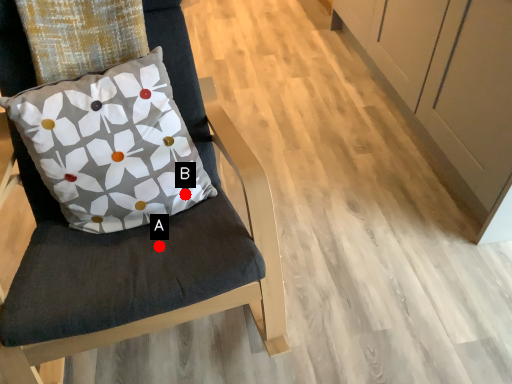
Question: Two points are circled on the image, labeled by A and B beside each circle. Which of the following is the farthest from the observer?

Choices:
 (A) A is further
 (B) B is further

Answer: (B)